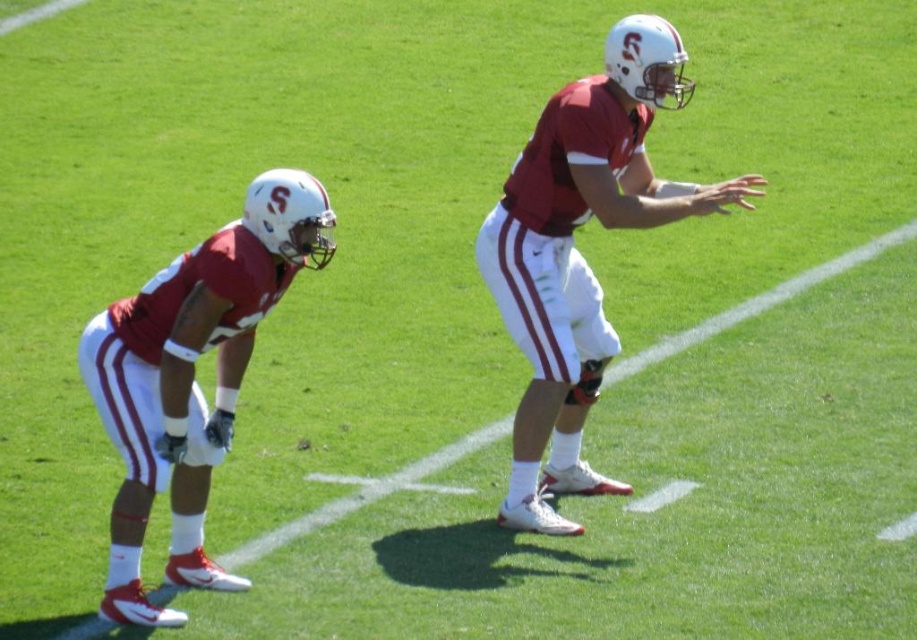
Is matte red uniform at center to the left of matte red uniform at left from the viewer's perspective?

No, matte red uniform at center is not to the left of matte red uniform at left.

Locate an element on the screen. matte red uniform at center is located at coordinates (579, 253).

The width and height of the screenshot is (917, 640). What are the coordinates of `matte red uniform at center` in the screenshot? It's located at (579, 253).